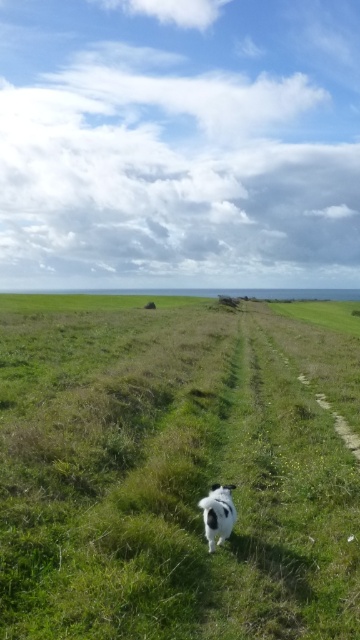
Question: Does green grassy at center have a larger size compared to black and white fur dog at center?

Choices:
 (A) no
 (B) yes

Answer: (B)

Question: Which of the following is the closest to the observer?

Choices:
 (A) black and white fur dog at center
 (B) green grassy at center

Answer: (B)

Question: Which object appears farthest from the camera in this image?

Choices:
 (A) black and white fur dog at center
 (B) green grassy at center

Answer: (A)

Question: Observing the image, what is the correct spatial positioning of green grassy at center in reference to black and white fur dog at center?

Choices:
 (A) above
 (B) below

Answer: (A)

Question: Which of the following is the farthest from the observer?

Choices:
 (A) (51, 496)
 (B) (223, 532)

Answer: (A)

Question: Does green grassy at center appear over black and white fur dog at center?

Choices:
 (A) yes
 (B) no

Answer: (A)